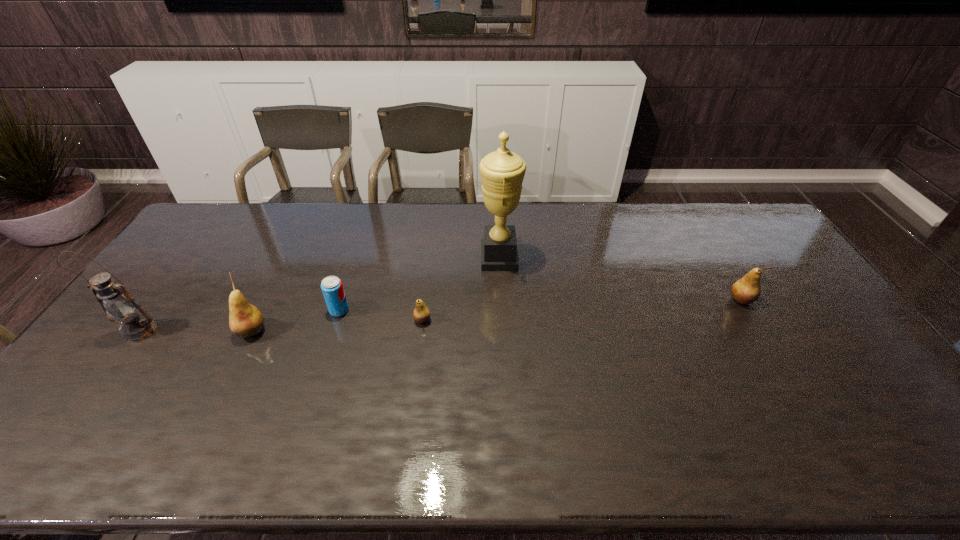
Where is `free space located on the back of the leftmost pear`? This screenshot has width=960, height=540. free space located on the back of the leftmost pear is located at coordinates (298, 238).

Locate an element on the screen. The image size is (960, 540). vacant region located on the left of the second pear from right to left is located at coordinates (346, 320).

This screenshot has height=540, width=960. What are the coordinates of `free region located 0.180m on the right of the farthest pear` in the screenshot? It's located at [x=812, y=300].

The height and width of the screenshot is (540, 960). In order to click on blank space located 0.080m at the front of the tallest object with handles in this screenshot , I will do `click(456, 258)`.

Identify the location of vacant space located at the front of the tallest object with handles. The height and width of the screenshot is (540, 960). (429, 258).

Locate an element on the screen. The width and height of the screenshot is (960, 540). vacant area located at the front of the tallest object with handles is located at coordinates point(453,258).

Find the location of `free space located on the right of the second tallest object`. free space located on the right of the second tallest object is located at coordinates (272, 330).

Locate an element on the screen. The width and height of the screenshot is (960, 540). free space located on the front of the third object from left to right is located at coordinates (322, 365).

Where is `object that is positioned at the far edge`? The width and height of the screenshot is (960, 540). object that is positioned at the far edge is located at coordinates (502, 172).

Where is `object that is at the left edge`? This screenshot has width=960, height=540. object that is at the left edge is located at coordinates (120, 307).